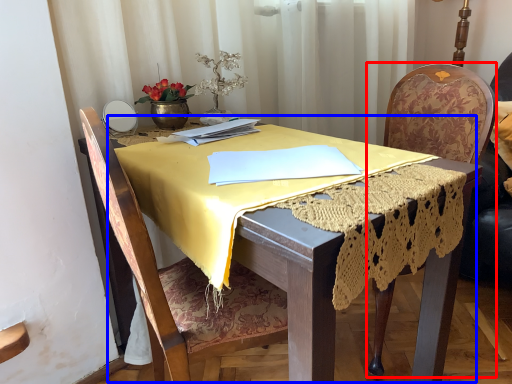
Question: Which object appears farthest to the camera in this image, chair (highlighted by a red box) or round table (highlighted by a blue box)?

Choices:
 (A) chair
 (B) round table

Answer: (A)